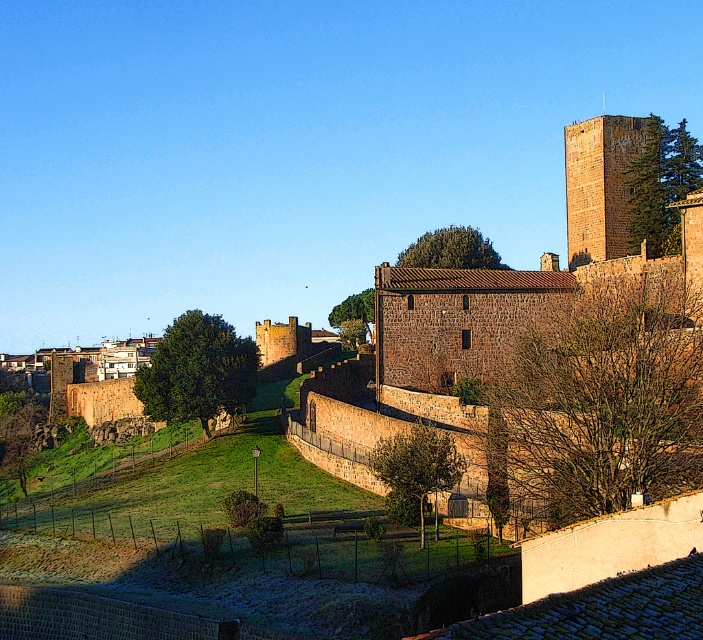
Question: Considering the relative positions of brown stone castle at center and brown stone tower at upper right in the image provided, where is brown stone castle at center located with respect to brown stone tower at upper right?

Choices:
 (A) above
 (B) below

Answer: (B)

Question: Does brown stone castle at center have a greater width compared to brown stone tower at upper right?

Choices:
 (A) yes
 (B) no

Answer: (A)

Question: Does brown stone castle at center have a smaller size compared to brown stone tower at upper right?

Choices:
 (A) yes
 (B) no

Answer: (B)